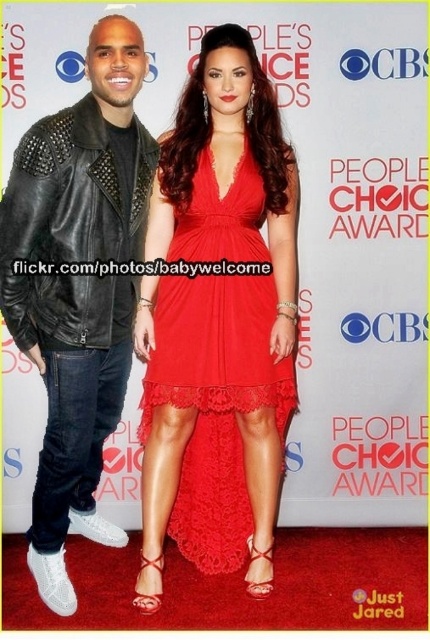
Question: Considering the relative positions of matte red dress at center and black leather jacket at left in the image provided, where is matte red dress at center located with respect to black leather jacket at left?

Choices:
 (A) right
 (B) left

Answer: (A)

Question: Does matte red dress at center appear on the right side of black leather jacket at left?

Choices:
 (A) yes
 (B) no

Answer: (A)

Question: Which of the following is the farthest from the observer?

Choices:
 (A) (104, 141)
 (B) (227, 99)

Answer: (B)

Question: Is matte red dress at center to the left of black leather jacket at left from the viewer's perspective?

Choices:
 (A) no
 (B) yes

Answer: (A)

Question: Which of the following is the farthest from the observer?

Choices:
 (A) (88, 468)
 (B) (209, 403)

Answer: (A)